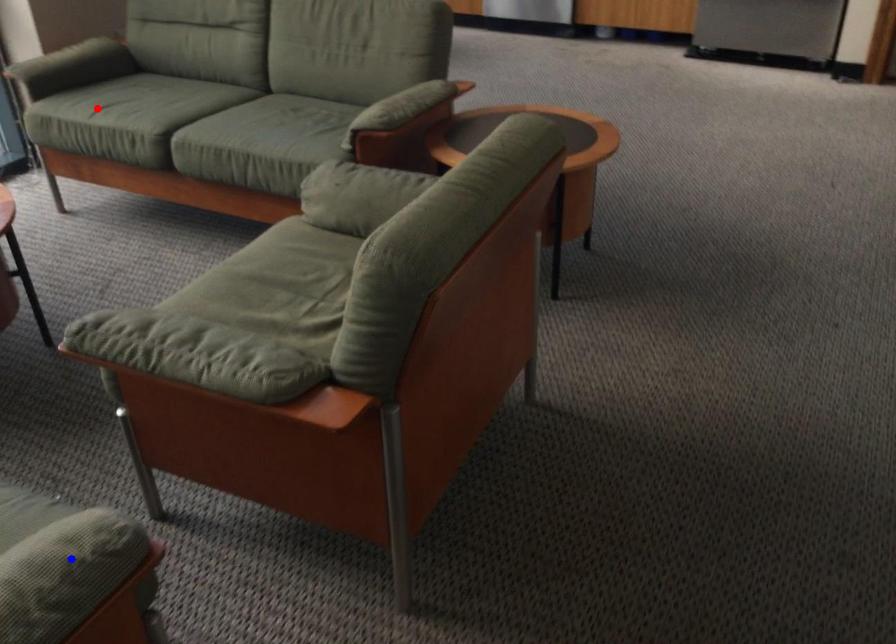
Question: In the image, two points are highlighted. Which point is nearer to the camera? Reply with the corresponding letter.

Choices:
 (A) blue point
 (B) red point

Answer: (A)